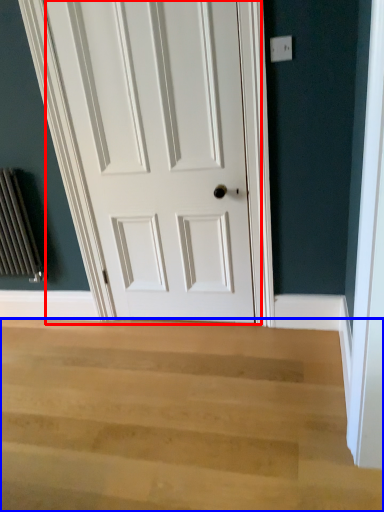
Question: Which point is closer to the camera, door (highlighted by a red box) or stairwell (highlighted by a blue box)?

Choices:
 (A) door
 (B) stairwell

Answer: (B)